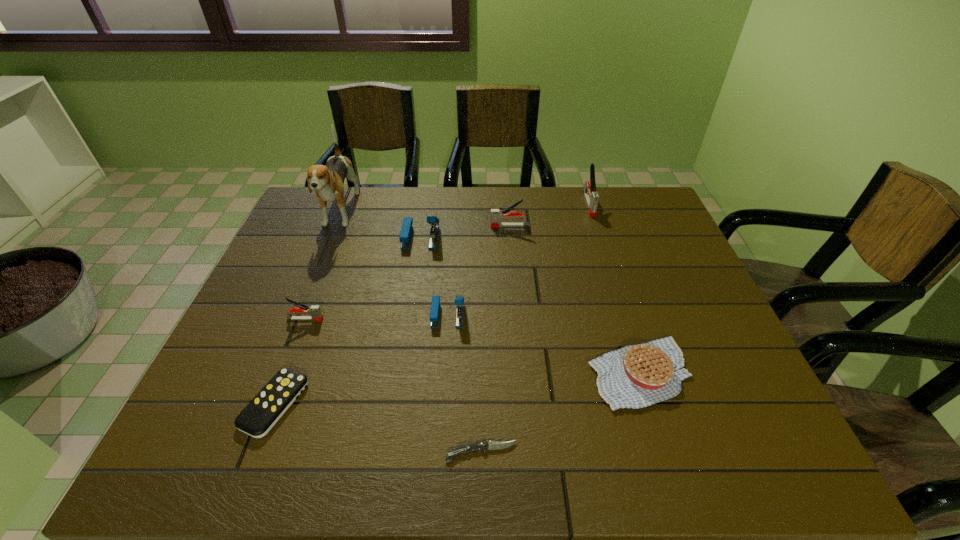
Locate an element on the screen. This screenshot has height=540, width=960. free location at the right edge of the desktop is located at coordinates (674, 262).

Image resolution: width=960 pixels, height=540 pixels. I want to click on vacant space at the near left corner of the desktop, so click(x=204, y=432).

The height and width of the screenshot is (540, 960). In the image, there is a desktop. What are the coordinates of `blank space at the far right corner` in the screenshot? It's located at (617, 221).

I want to click on blank area at the near right corner, so click(x=757, y=464).

Locate an element on the screen. The image size is (960, 540). blank region between the tallest object and the third shortest object is located at coordinates (490, 293).

Find the location of a particular element. free space between the third stapler from right to left and the nearest object is located at coordinates (465, 383).

Locate an element on the screen. This screenshot has width=960, height=540. free point between the nearer blue stapler and the remote control is located at coordinates (361, 359).

This screenshot has height=540, width=960. I want to click on vacant space that is in between the third shortest object and the second biggest gray stapler, so click(x=574, y=299).

I want to click on vacant area between the second smallest gray stapler and the nearest object, so click(x=495, y=339).

In order to click on free spot between the second nearest gray stapler and the puppy in this screenshot , I will do `click(424, 219)`.